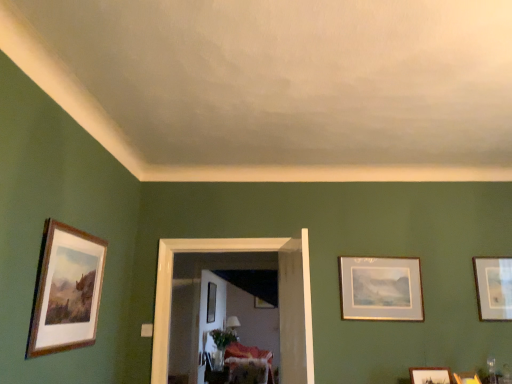
Question: Which direction should I rotate to look at matte black picture frame at center, the second picture frame when ordered from left to right?

Choices:
 (A) left
 (B) right

Answer: (A)

Question: From the image's perspective, would you say wooden frame at left, arranged as the 7th picture frame when viewed from the right, is positioned over matte black picture frame at center, the sixth picture frame from the right?

Choices:
 (A) yes
 (B) no

Answer: (A)

Question: Considering the relative sizes of wooden frame at left, which is the first picture frame in left-to-right order, and matte black picture frame at center, marked as the second picture frame in a back-to-front arrangement, in the image provided, is wooden frame at left, which is the first picture frame in left-to-right order, smaller than matte black picture frame at center, marked as the second picture frame in a back-to-front arrangement,?

Choices:
 (A) no
 (B) yes

Answer: (B)

Question: Does wooden frame at left, the seventh picture frame positioned from the bottom, have a lesser width compared to matte black picture frame at center, which appears as the sixth picture frame when viewed from the front?

Choices:
 (A) yes
 (B) no

Answer: (A)

Question: Is wooden frame at left, the seventh picture frame positioned from the bottom, shorter than matte black picture frame at center, marked as the second picture frame in a back-to-front arrangement?

Choices:
 (A) yes
 (B) no

Answer: (A)

Question: Is wooden frame at left, which is the first picture frame from top to bottom, facing away from matte black picture frame at center, marked as the second picture frame in a back-to-front arrangement?

Choices:
 (A) no
 (B) yes

Answer: (A)

Question: From a real-world perspective, is wooden frame at left, arranged as the 7th picture frame when viewed from the right, below matte black picture frame at center, the sixth picture frame from the right?

Choices:
 (A) yes
 (B) no

Answer: (A)

Question: Can wooden picture frame at lower right, marked as the sixth picture frame in a left-to-right arrangement, be found inside wooden framed picture at right, the 7th picture frame in the left-to-right sequence?

Choices:
 (A) yes
 (B) no

Answer: (B)

Question: Is wooden framed picture at right, which is the second picture frame from top to bottom, positioned with its back to wooden picture frame at lower right, the 4th picture frame when ordered from bottom to top?

Choices:
 (A) yes
 (B) no

Answer: (B)

Question: Considering the relative sizes of wooden framed picture at right, the 7th picture frame in the left-to-right sequence, and wooden picture frame at lower right, which is the second picture frame in right-to-left order, in the image provided, is wooden framed picture at right, the 7th picture frame in the left-to-right sequence, bigger than wooden picture frame at lower right, which is the second picture frame in right-to-left order,?

Choices:
 (A) no
 (B) yes

Answer: (B)

Question: From the image's perspective, is wooden framed picture at right, placed as the fourth picture frame when sorted from front to back, under wooden picture frame at lower right, marked as the sixth picture frame in a left-to-right arrangement?

Choices:
 (A) no
 (B) yes

Answer: (A)

Question: Is wooden framed picture at right, placed as the fourth picture frame when sorted from front to back, shorter than wooden picture frame at lower right, arranged as the 6th picture frame when viewed from the back?

Choices:
 (A) yes
 (B) no

Answer: (B)

Question: From a real-world perspective, is wooden framed picture at right, the 6th picture frame ordered from the bottom, physically above wooden picture frame at lower right, which appears as the fourth picture frame when viewed from the top?

Choices:
 (A) no
 (B) yes

Answer: (B)

Question: Is wooden picture frame at center, which appears as the fifth picture frame when viewed from the right, located within velvet floral sofa at center?

Choices:
 (A) yes
 (B) no

Answer: (B)